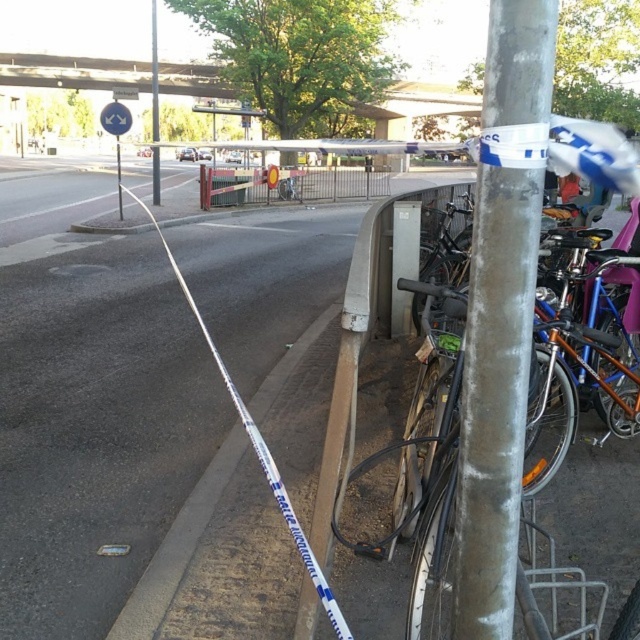
You are a city planner assessing the urban street scene. You notice the silver metallic pole at upper center and the white plastic street sign at upper center. Which object is taller?

The silver metallic pole at upper center is much taller than the white plastic street sign at upper center.

You are standing at the point labeled as point (500, 312) in the image. What object are you touching?

The point labeled as point 0.483 is on silver metallic pole at center, so you are touching the silver metallic pole at center.

You are a delivery person trying to park your bike between the gray concrete curb at lower left and the silver metallic pole at upper center. Which object should you position your bike closer to if you want to maximize the available space for your bike?

The gray concrete curb at lower left is thinner than the silver metallic pole at upper center, so positioning your bike closer to the gray concrete curb at lower left would allow more space for the bike.